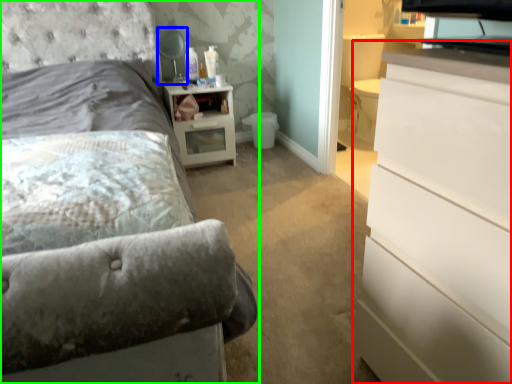
Question: Which object is positioned farthest from chest of drawers (highlighted by a red box)? Select from table lamp (highlighted by a blue box) and bed (highlighted by a green box).

Choices:
 (A) table lamp
 (B) bed

Answer: (A)